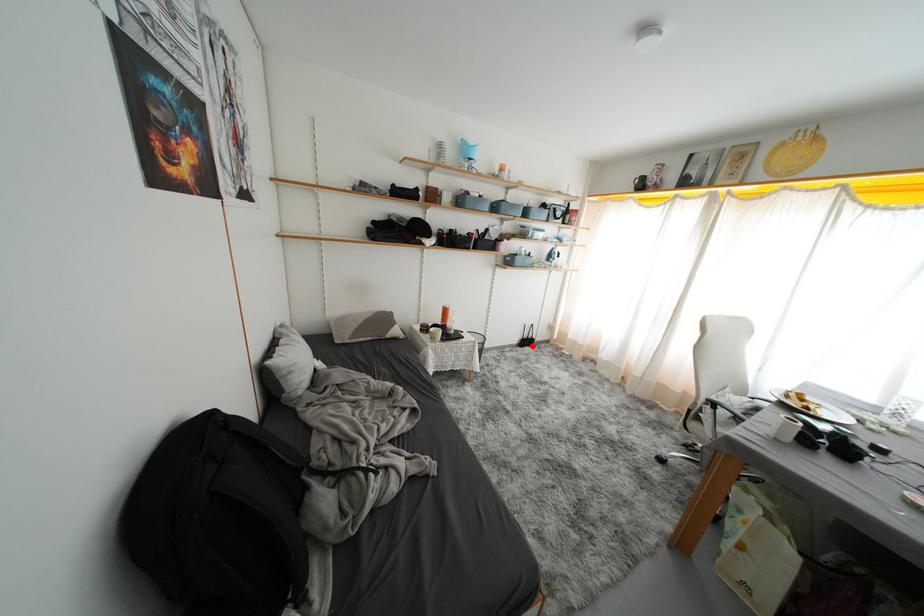
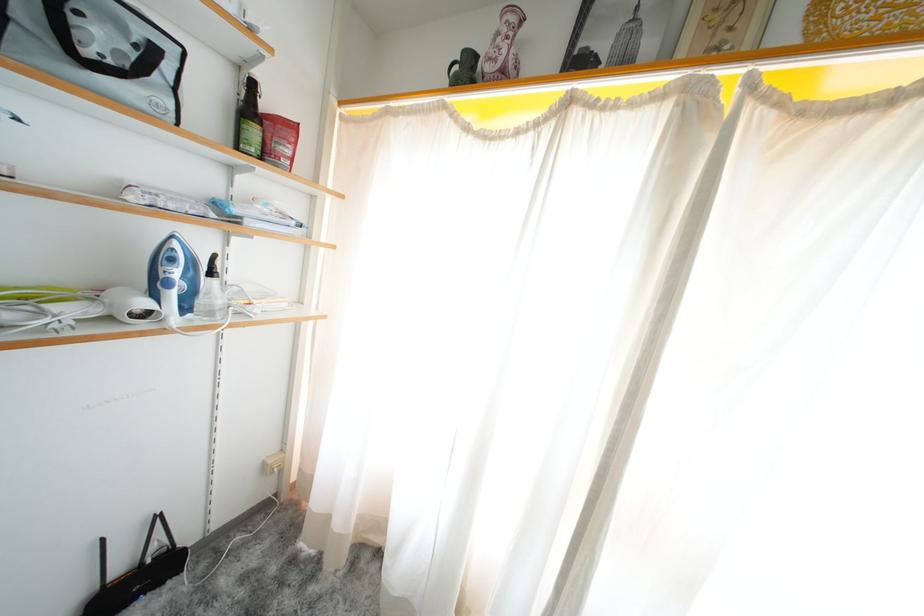
Find the pixel in the second image that matches the highlighted location in the first image.

(143, 586)